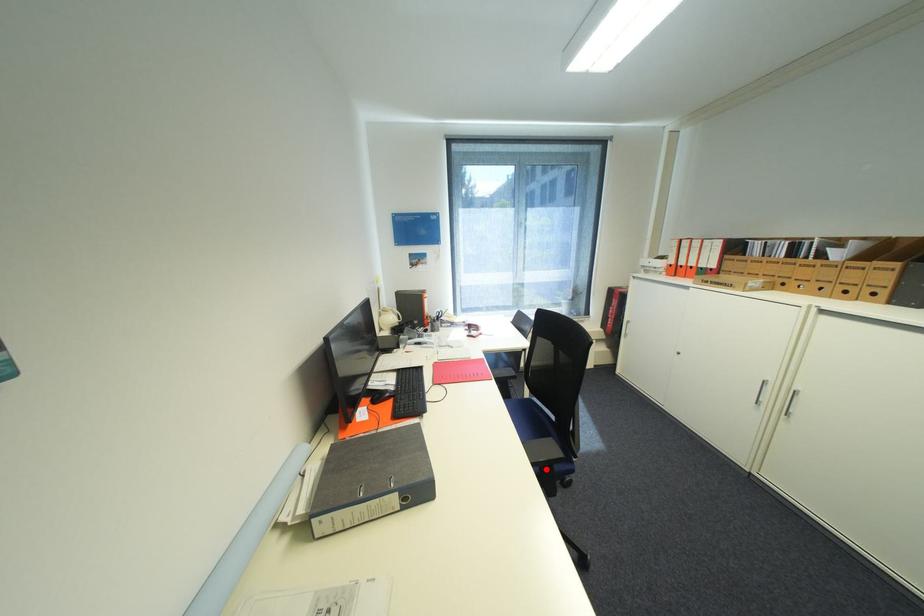
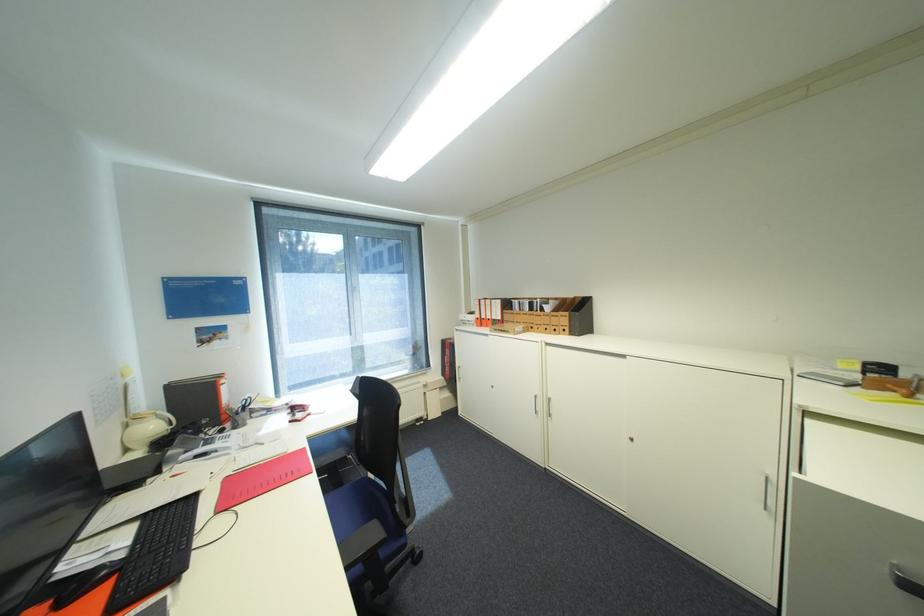
The point at the highlighted location is marked in the first image. Where is the corresponding point in the second image?

(367, 569)